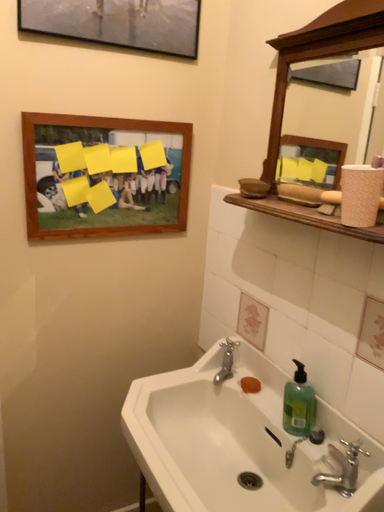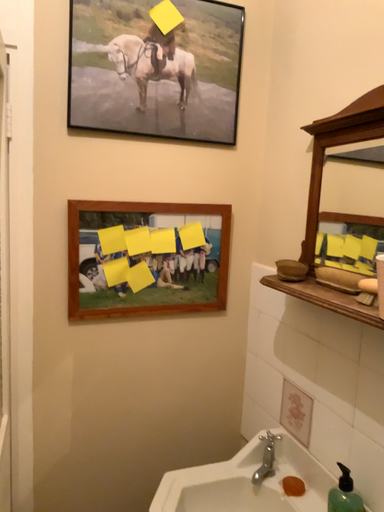
Question: Which way did the camera rotate in the video?

Choices:
 (A) rotated left
 (B) rotated right

Answer: (A)